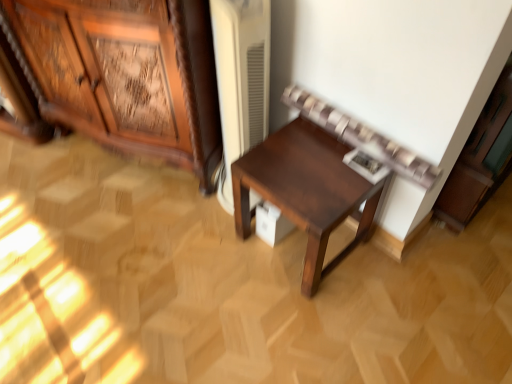
Identify the location of vacant area that is in front of white matte cabinet at upper right, arranged as the 1th cabinetry when viewed from the right. (461, 266).